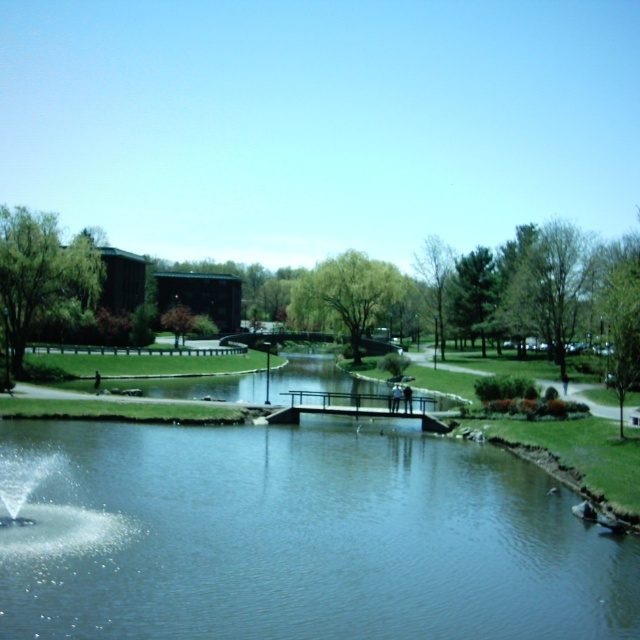
Question: Which object appears farthest from the camera in this image?

Choices:
 (A) clear water fountain at lower left
 (B) clear water at center

Answer: (A)

Question: Does clear water at center lie in front of clear water fountain at lower left?

Choices:
 (A) yes
 (B) no

Answer: (A)

Question: Does clear water at center have a smaller size compared to clear water fountain at lower left?

Choices:
 (A) yes
 (B) no

Answer: (B)

Question: Does clear water at center lie behind clear water fountain at lower left?

Choices:
 (A) yes
 (B) no

Answer: (B)